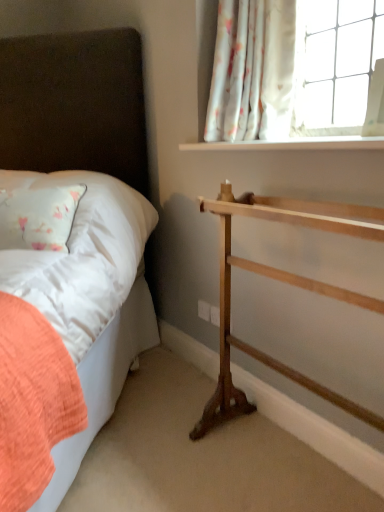
Question: From a real-world perspective, is natural wood towel rack at right positioned under matte white bed at left based on gravity?

Choices:
 (A) no
 (B) yes

Answer: (B)

Question: Considering the relative sizes of natural wood towel rack at right and matte white bed at left in the image provided, is natural wood towel rack at right shorter than matte white bed at left?

Choices:
 (A) yes
 (B) no

Answer: (A)

Question: Does natural wood towel rack at right appear on the right side of matte white bed at left?

Choices:
 (A) no
 (B) yes

Answer: (B)

Question: Does natural wood towel rack at right have a greater height compared to matte white bed at left?

Choices:
 (A) yes
 (B) no

Answer: (B)

Question: Is natural wood towel rack at right looking in the opposite direction of matte white bed at left?

Choices:
 (A) yes
 (B) no

Answer: (B)

Question: In terms of size, does matte white bed at left appear bigger or smaller than natural wood towel rack at right?

Choices:
 (A) small
 (B) big

Answer: (B)

Question: Is matte white bed at left in front of or behind natural wood towel rack at right in the image?

Choices:
 (A) front
 (B) behind

Answer: (A)

Question: From a real-world perspective, is matte white bed at left positioned above or below natural wood towel rack at right?

Choices:
 (A) below
 (B) above

Answer: (B)

Question: Which is correct: matte white bed at left is inside natural wood towel rack at right, or outside of it?

Choices:
 (A) outside
 (B) inside

Answer: (A)

Question: Does point (238, 80) appear closer or farther from the camera than point (362, 146)?

Choices:
 (A) closer
 (B) farther

Answer: (B)

Question: Is white floral fabric at upper right situated inside white smooth window sill at upper right or outside?

Choices:
 (A) inside
 (B) outside

Answer: (B)

Question: From the image's perspective, is white floral fabric at upper right above or below white smooth window sill at upper right?

Choices:
 (A) below
 (B) above

Answer: (B)

Question: In the image, is white floral fabric at upper right on the left side or the right side of white smooth window sill at upper right?

Choices:
 (A) left
 (B) right

Answer: (A)

Question: In terms of width, does natural wood towel rack at right look wider or thinner when compared to white floral fabric at upper right?

Choices:
 (A) thin
 (B) wide

Answer: (B)

Question: From the image's perspective, is natural wood towel rack at right located above or below white floral fabric at upper right?

Choices:
 (A) below
 (B) above

Answer: (A)